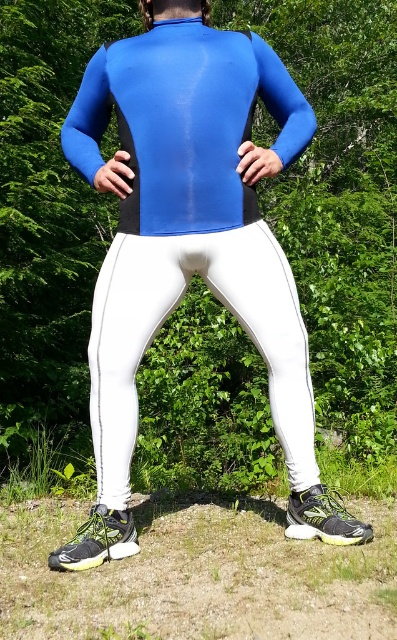
Question: Can you confirm if white matte leggings at center is smaller than green grass at lower center?

Choices:
 (A) no
 (B) yes

Answer: (B)

Question: Can you confirm if white matte leggings at center is wider than green grass at lower center?

Choices:
 (A) yes
 (B) no

Answer: (B)

Question: Which of the following is the farthest from the observer?

Choices:
 (A) (287, 472)
 (B) (52, 484)

Answer: (B)

Question: Is the position of white matte leggings at center less distant than that of green grass at lower center?

Choices:
 (A) no
 (B) yes

Answer: (B)